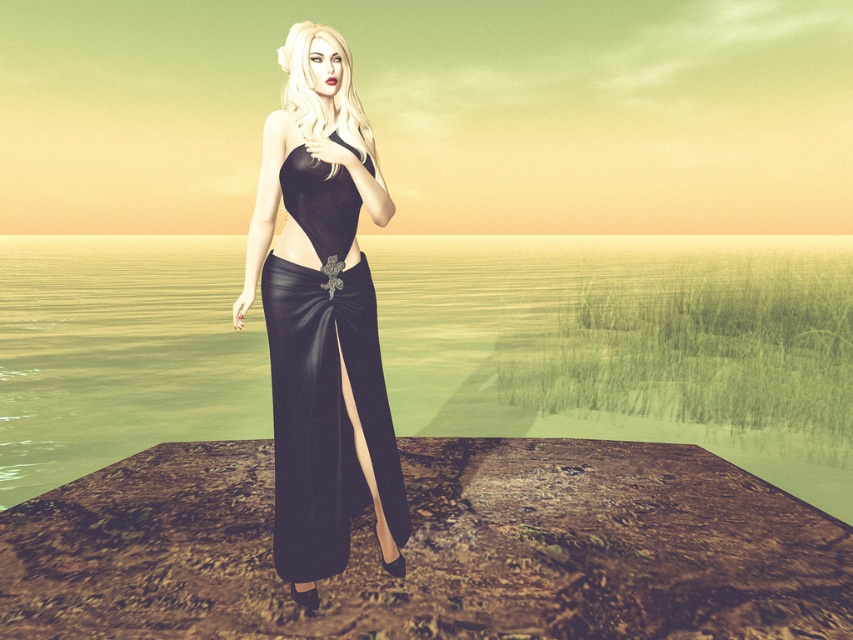
You are standing at the point closer to the viewer between the two points, point(198, 266) and point(383, 496). Which point are you at?

You are at point(198, 266) because it is further to the viewer than point(383, 496).

You are an artist planning to paint the scene. You need to decide the vertical positioning of the glossy water at center and the satin black dress at center. Which one should be placed higher on the canvas?

The glossy water at center should be placed higher on the canvas since it has a greater height compared to the satin black dress at center.